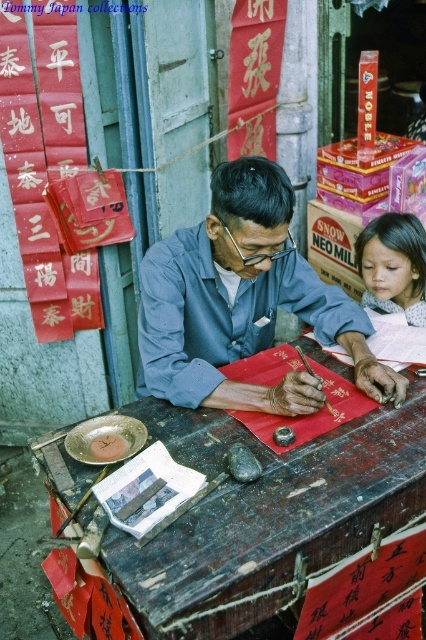
Question: Which point is farther to the camera?

Choices:
 (A) wooden table at center
 (B) smooth skin girl at right
 (C) blue fabric shirt at center
 (D) smooth paper scroll at center

Answer: (B)

Question: Can you confirm if blue fabric shirt at center is wider than smooth paper scroll at center?

Choices:
 (A) yes
 (B) no

Answer: (A)

Question: Does wooden table at center appear on the left side of blue fabric shirt at center?

Choices:
 (A) yes
 (B) no

Answer: (A)

Question: Among these objects, which one is nearest to the camera?

Choices:
 (A) smooth paper scroll at center
 (B) smooth skin girl at right
 (C) blue fabric shirt at center

Answer: (C)

Question: Can you confirm if smooth skin girl at right is wider than smooth paper scroll at center?

Choices:
 (A) yes
 (B) no

Answer: (B)

Question: Which object appears closest to the camera in this image?

Choices:
 (A) smooth skin girl at right
 (B) blue fabric shirt at center
 (C) wooden table at center
 (D) smooth paper scroll at center

Answer: (C)